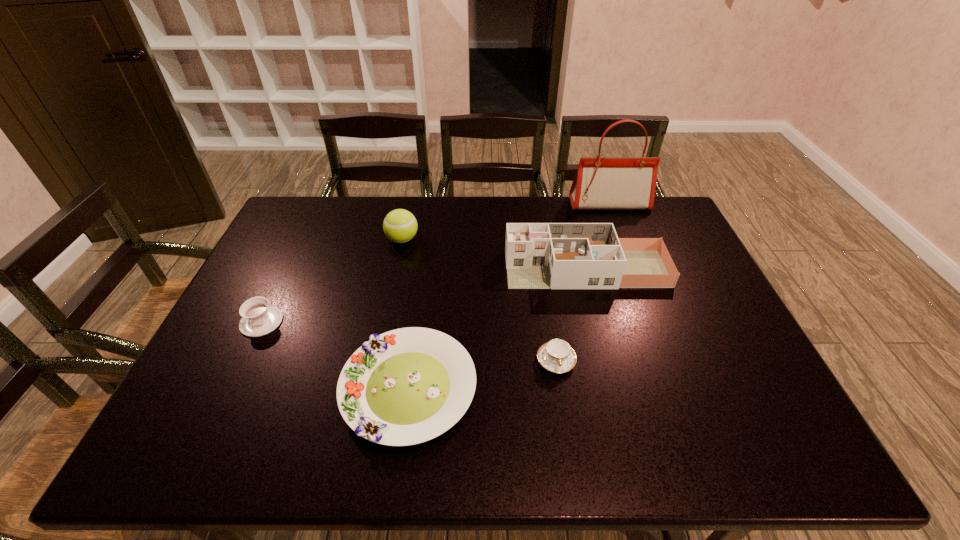
This screenshot has width=960, height=540. I want to click on handbag that is at the right edge, so click(x=617, y=183).

Locate an element on the screen. This screenshot has width=960, height=540. dollhouse that is at the right edge is located at coordinates (538, 255).

This screenshot has width=960, height=540. Find the location of `object at the far right corner`. object at the far right corner is located at coordinates 617,183.

Locate an element on the screen. The width and height of the screenshot is (960, 540). vacant space at the far edge of the desktop is located at coordinates (541, 221).

In order to click on vacant area at the left edge of the desktop in this screenshot , I will do `click(218, 420)`.

Where is `vacant space at the right edge`? The height and width of the screenshot is (540, 960). vacant space at the right edge is located at coordinates (787, 418).

Identify the location of free point at the near left corner. The width and height of the screenshot is (960, 540). (190, 433).

What are the coordinates of `empty space that is in between the third farthest object and the second farthest object` in the screenshot? It's located at (494, 254).

The width and height of the screenshot is (960, 540). In order to click on vacant space that is in between the third farthest object and the nearer teacup in this screenshot , I will do `click(571, 315)`.

The image size is (960, 540). I want to click on vacant space that's between the nearer teacup and the dollhouse, so click(x=571, y=315).